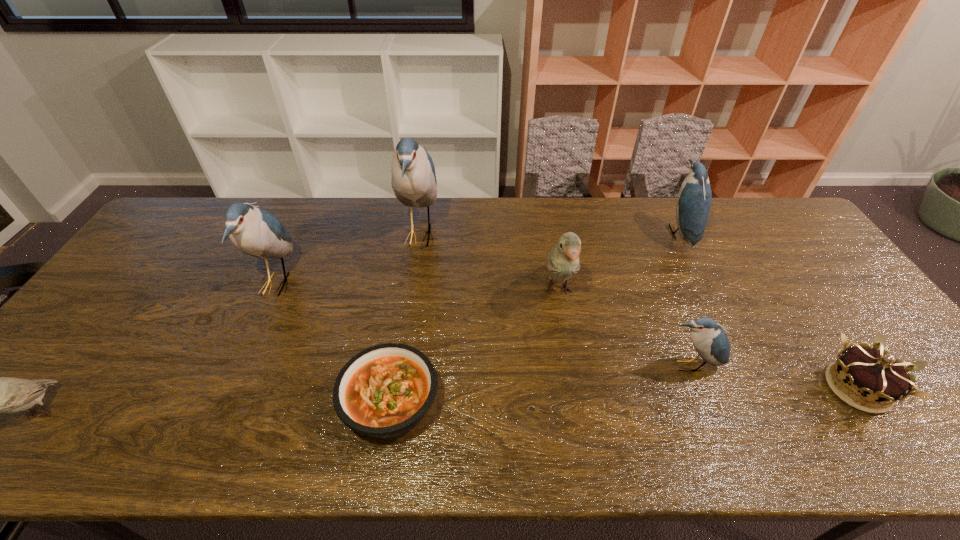
This screenshot has height=540, width=960. I want to click on vacant space located on the right of the crown, so click(924, 388).

You are a GUI agent. You are given a task and a screenshot of the screen. Output one action in this format:
    pyautogui.click(x=<x>, y=<y>)
    Task: Click on the vacant region located 0.050m on the right of the stew
    
    Given the screenshot: What is the action you would take?
    pyautogui.click(x=462, y=403)

Where is `crown at the near edge`? The image size is (960, 540). crown at the near edge is located at coordinates (875, 374).

The width and height of the screenshot is (960, 540). I want to click on stew located at the near edge, so coord(384,391).

At what (x,y) coordinates should I click in order to perform the action: click on object at the right edge. Please return your answer as a coordinate pair (x, y). The image size is (960, 540). Looking at the image, I should click on (875, 374).

Locate an element on the screen. object located at the near right corner is located at coordinates (875, 374).

Where is `free space at the far edge`? The width and height of the screenshot is (960, 540). free space at the far edge is located at coordinates (553, 204).

The height and width of the screenshot is (540, 960). In order to click on free point at the near edge in this screenshot , I will do `click(837, 459)`.

The image size is (960, 540). In the image, there is a desktop. In order to click on free region at the left edge in this screenshot , I will do `click(191, 249)`.

Identify the location of free space at the right edge. (801, 245).